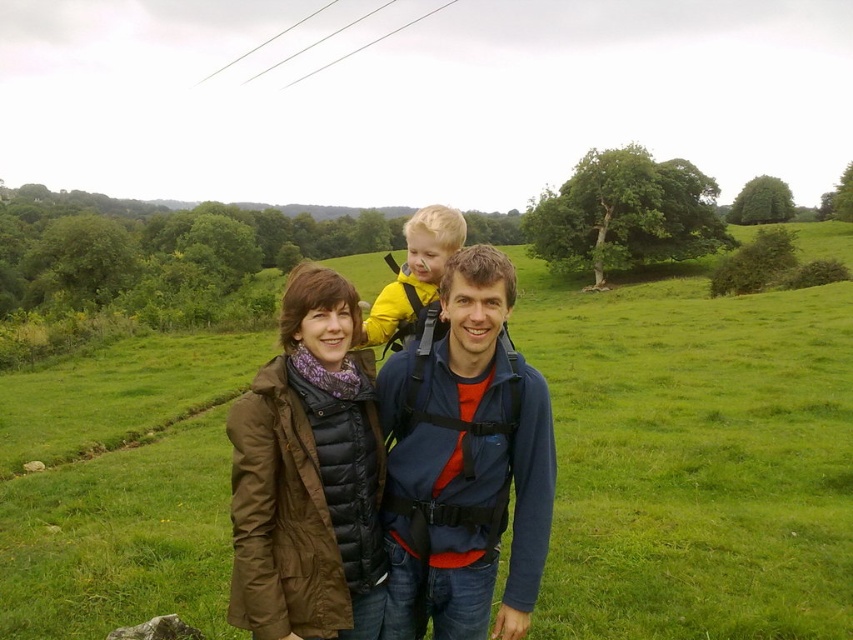
Is blue fabric backpack at center in front of brown quilted jacket at center?

That is False.

Does blue fabric backpack at center appear on the left side of brown quilted jacket at center?

In fact, blue fabric backpack at center is to the right of brown quilted jacket at center.

Is point (461, 636) more distant than point (344, 454)?

That is True.

Where is `blue fabric backpack at center`? blue fabric backpack at center is located at coordinates (465, 464).

Who is positioned more to the right, green grassy field at center or brown quilted jacket at center?

From the viewer's perspective, green grassy field at center appears more on the right side.

Is point (805, 394) farther from camera compared to point (309, 397)?

Yes.

Locate an element on the screen. The height and width of the screenshot is (640, 853). green grassy field at center is located at coordinates (694, 458).

Which of these two, brown quilted jacket at center or yellow fabric baby carrier at center, stands taller?

yellow fabric baby carrier at center

The width and height of the screenshot is (853, 640). I want to click on brown quilted jacket at center, so click(308, 474).